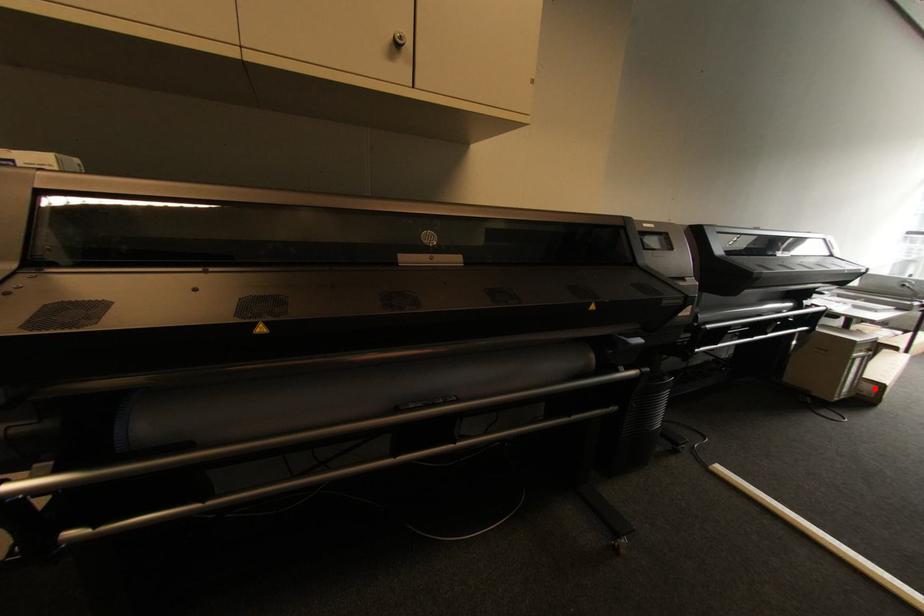
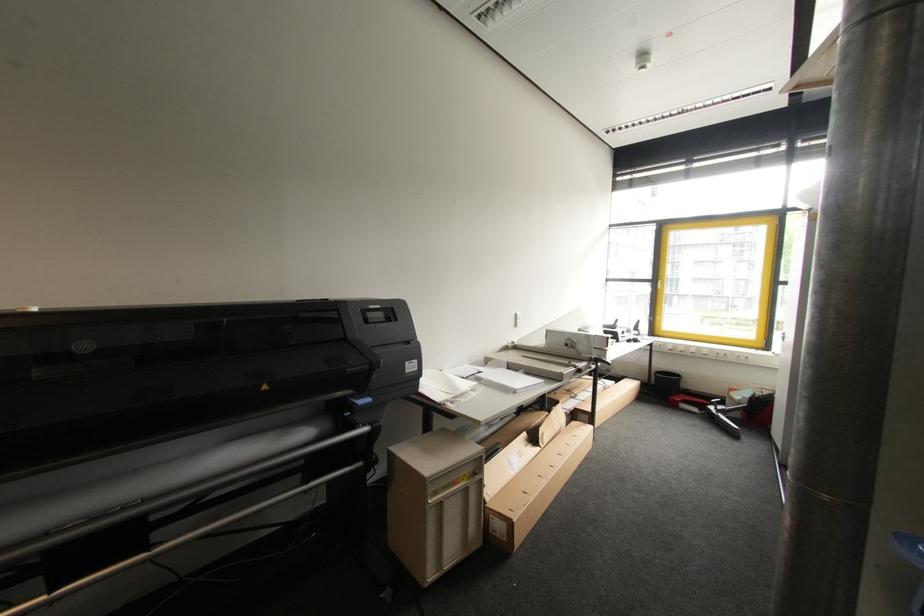
Question: I am providing you with two images of the same scene from different viewpoints. In image1, a red point is highlighted. Considering the same 3D point in image2, which of the following is correct?

Choices:
 (A) It is closer
 (B) It is farther

Answer: (B)